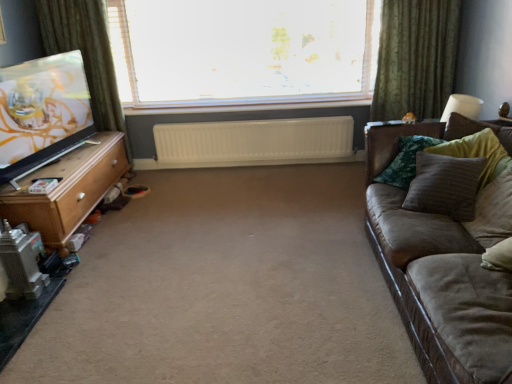
Where is `blank space situated above light brown wood tv stand at left (from a real-world perspective)`? This screenshot has width=512, height=384. blank space situated above light brown wood tv stand at left (from a real-world perspective) is located at coordinates (68, 162).